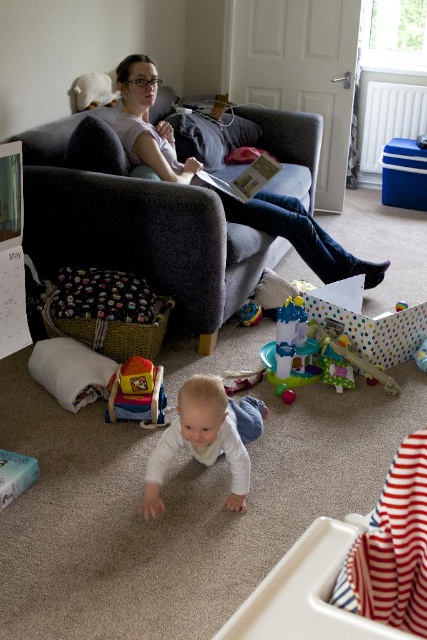
You are a security camera monitoring the living room. The woman is seated on the gray armchair reading, and the white soft baby at center is crawling. Based on the baby

The white soft baby at center is located at point (205, 438) in the image coordinates.